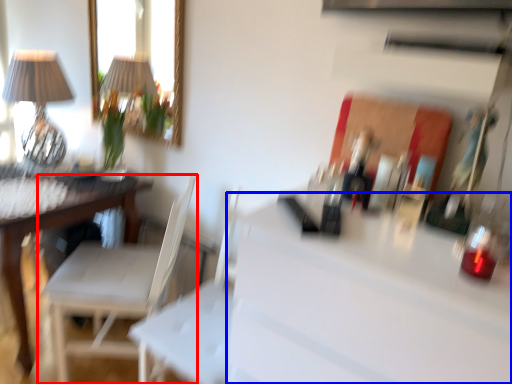
Question: Which point is further to the camera, chair (highlighted by a red box) or counter top (highlighted by a blue box)?

Choices:
 (A) chair
 (B) counter top

Answer: (A)